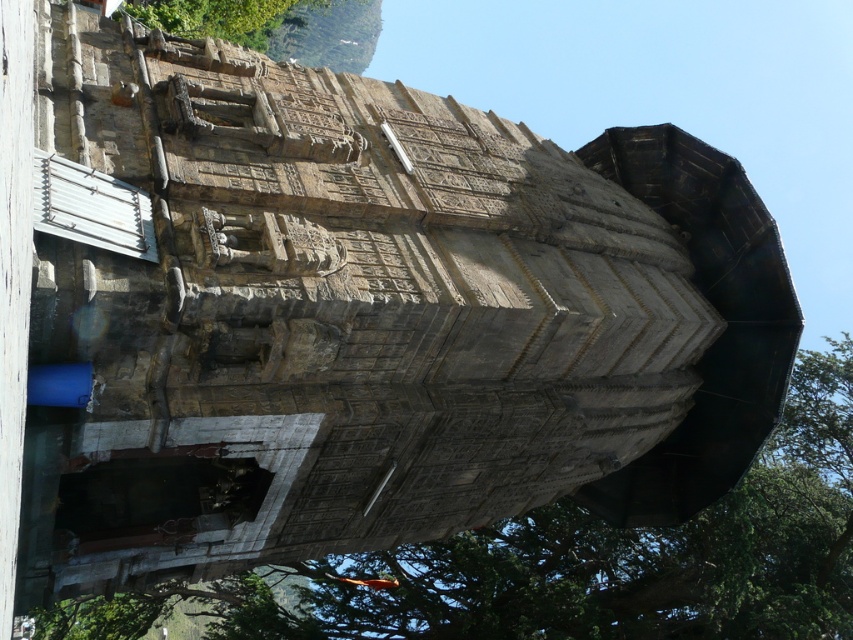
Question: Which of the following is the closest to the observer?

Choices:
 (A) green leafy tree at lower left
 (B) green leafy tree at upper center

Answer: (A)

Question: Considering the relative positions of green leafy tree at lower left and green leafy tree at upper center in the image provided, where is green leafy tree at lower left located with respect to green leafy tree at upper center?

Choices:
 (A) right
 (B) left

Answer: (A)

Question: Is green leafy tree at lower left to the right of green leafy tree at upper center from the viewer's perspective?

Choices:
 (A) no
 (B) yes

Answer: (B)

Question: Is green leafy tree at lower left to the right of green leafy tree at upper center from the viewer's perspective?

Choices:
 (A) no
 (B) yes

Answer: (B)

Question: Which object appears farthest from the camera in this image?

Choices:
 (A) green leafy tree at lower left
 (B) green leafy tree at upper center

Answer: (B)